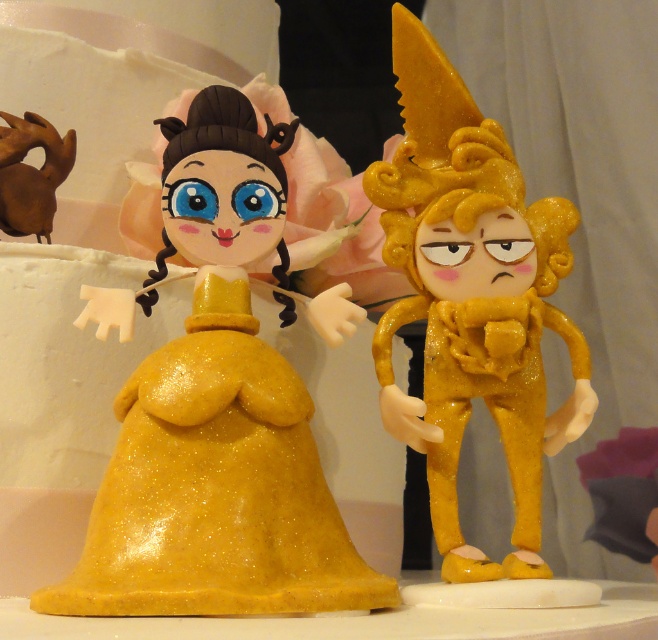
Question: Can you confirm if glittery gold dress at center is thinner than glittery gold figure at right?

Choices:
 (A) no
 (B) yes

Answer: (A)

Question: Which object is closer to the camera taking this photo?

Choices:
 (A) glittery gold figure at right
 (B) glittery gold dress at center

Answer: (B)

Question: Is glittery gold dress at center below glittery gold figure at right?

Choices:
 (A) no
 (B) yes

Answer: (B)

Question: Does glittery gold dress at center have a greater width compared to glittery gold figure at right?

Choices:
 (A) no
 (B) yes

Answer: (B)